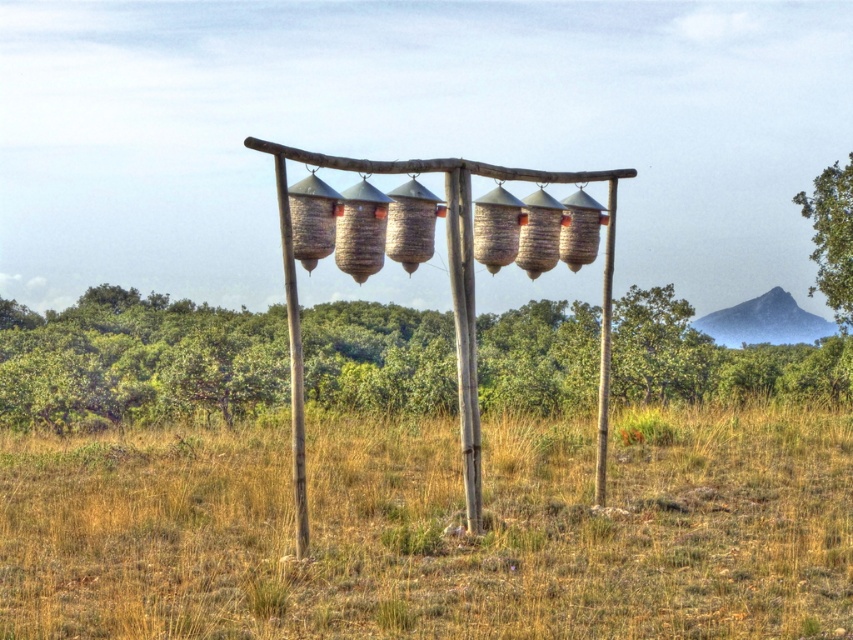
Does green leafy tree at center have a lesser width compared to green leafy tree at upper right?

Incorrect, green leafy tree at center's width is not less than green leafy tree at upper right's.

Does green leafy tree at center appear on the right side of green leafy tree at upper right?

Incorrect, green leafy tree at center is not on the right side of green leafy tree at upper right.

You are a GUI agent. You are given a task and a screenshot of the screen. Output one action in this format:
    pyautogui.click(x=<x>, y=<y>)
    Task: Click on the green leafy tree at center
    This screenshot has width=853, height=640.
    Given the screenshot: What is the action you would take?
    pyautogui.click(x=137, y=362)

At what (x,y) coordinates should I click in order to perform the action: click on green leafy tree at center. Please return your answer as a coordinate pair (x, y). This screenshot has width=853, height=640. Looking at the image, I should click on (137, 362).

Which of these two, dry grass at center or green leafy tree at center, stands taller?

Standing taller between the two is green leafy tree at center.

Does dry grass at center have a lesser width compared to green leafy tree at center?

Yes, dry grass at center is thinner than green leafy tree at center.

Is point (447, 428) positioned behind point (413, 362)?

That is False.

In order to click on dry grass at center in this screenshot , I will do [433, 531].

Between dry grass at center and green leafy tree at upper right, which one has more height?

green leafy tree at upper right is taller.

Is dry grass at center positioned in front of green leafy tree at upper right?

That is True.

Is point (248, 509) closer to camera compared to point (807, 204)?

That is True.

Locate an element on the screen. This screenshot has width=853, height=640. dry grass at center is located at coordinates (433, 531).